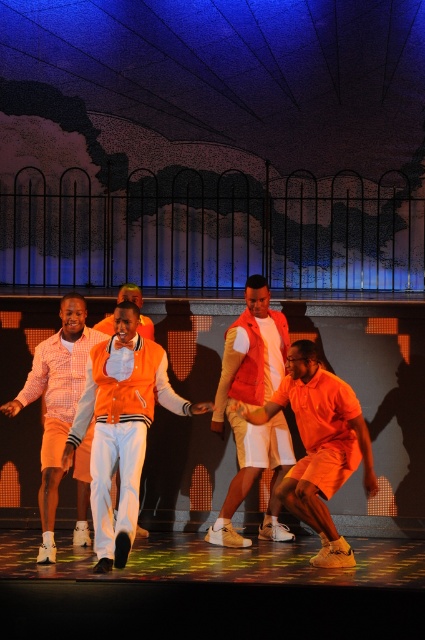
You are standing on the stage and want to place a spotlight exactly at point (102, 540). The spotlight has a minimum focus distance of 9 meters. Will the spotlight be able to focus properly on that point?

The distance of point (102, 540) from the camera is 9.43 meters, which is greater than the spotlight minimum focus distance of 9 meters. Therefore, the spotlight will be able to focus properly on that point.

You are a stage director observing the performance. You notice two points marked on the stage floor at coordinates point (124, 419) and point (311, 420). Which point is closer to the audience?

Point (124, 419) is in front of point (311, 420), so it is closer to the audience.